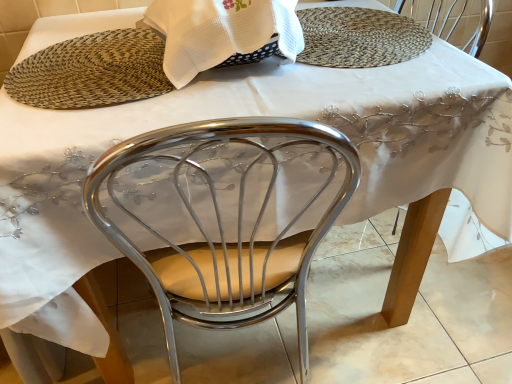
This screenshot has height=384, width=512. Identify the location of empty space that is ontop of woven mat at upper center. (96, 61).